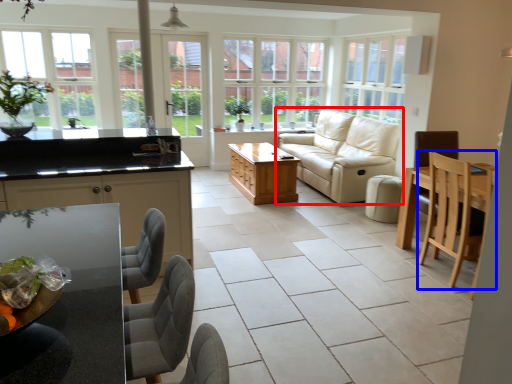
Question: Which of the following is the closest to the observer, studio couch (highlighted by a red box) or chair (highlighted by a blue box)?

Choices:
 (A) studio couch
 (B) chair

Answer: (B)